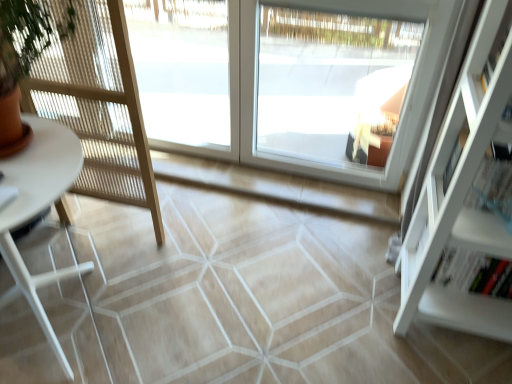
The height and width of the screenshot is (384, 512). I want to click on vacant space behind white glossy table at left, so click(99, 247).